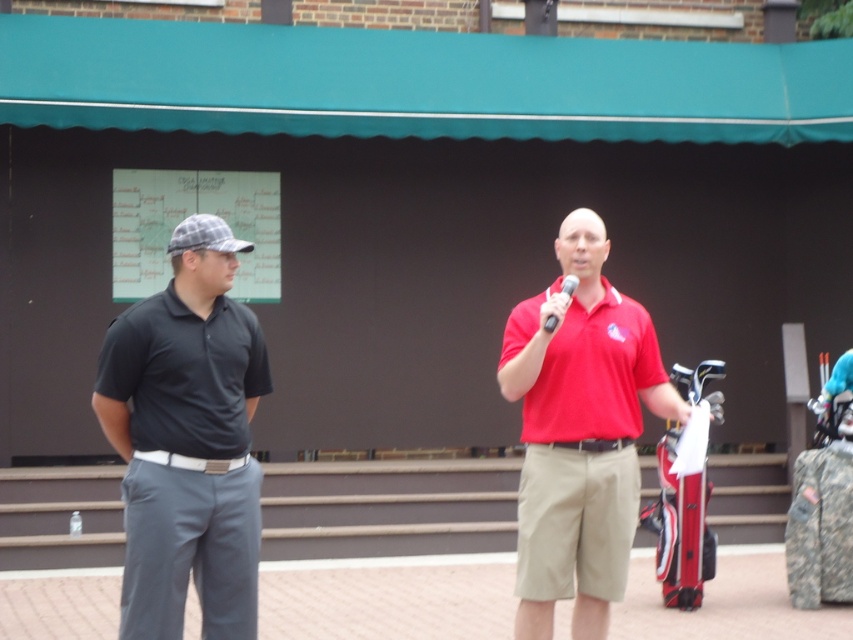
Can you confirm if matte red shirt at center is positioned to the right of matte red polo shirt at center?

Correct, you'll find matte red shirt at center to the right of matte red polo shirt at center.

The width and height of the screenshot is (853, 640). Find the location of `matte red shirt at center`. matte red shirt at center is located at coordinates (579, 433).

Does matte black polo shirt at left appear on the left side of matte red polo shirt at center?

Yes, matte black polo shirt at left is to the left of matte red polo shirt at center.

Does matte black polo shirt at left have a greater width compared to matte red polo shirt at center?

Incorrect, matte black polo shirt at left's width does not surpass matte red polo shirt at center's.

At what (x,y) coordinates should I click in order to perform the action: click on matte black polo shirt at left. Please return your answer as a coordinate pair (x, y). This screenshot has width=853, height=640. Looking at the image, I should click on (184, 374).

Does dark gray cotton polo shirt at left appear on the right side of matte black polo shirt at left?

In fact, dark gray cotton polo shirt at left is to the left of matte black polo shirt at left.

Between point (200, 465) and point (223, 362), which one is positioned behind?

Point (223, 362)

Find the location of a particular element. The image size is (853, 640). dark gray cotton polo shirt at left is located at coordinates (187, 440).